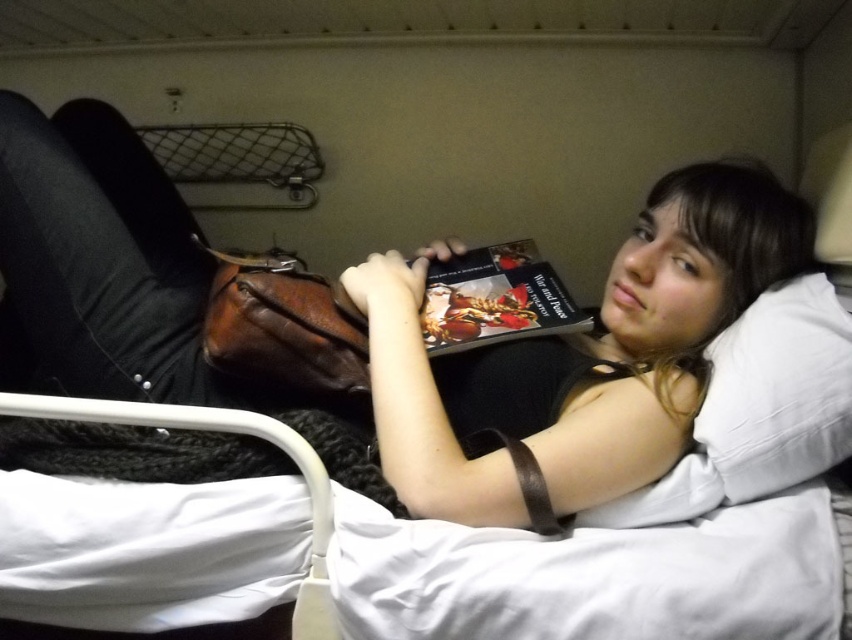
Question: Is the position of matte black book at upper center more distant than that of hardcover book at center?

Choices:
 (A) no
 (B) yes

Answer: (A)

Question: Among these points, which one is farthest from the camera?

Choices:
 (A) (484, 276)
 (B) (833, 394)

Answer: (A)

Question: Can you confirm if matte black book at upper center is positioned to the right of hardcover book at center?

Choices:
 (A) yes
 (B) no

Answer: (B)

Question: Is white soft pillow at upper right positioned behind hardcover book at center?

Choices:
 (A) no
 (B) yes

Answer: (A)

Question: Which point is closer to the camera?

Choices:
 (A) white soft pillow at upper right
 (B) hardcover book at center

Answer: (A)

Question: Among these objects, which one is farthest from the camera?

Choices:
 (A) matte black book at upper center
 (B) white soft pillow at upper right

Answer: (B)